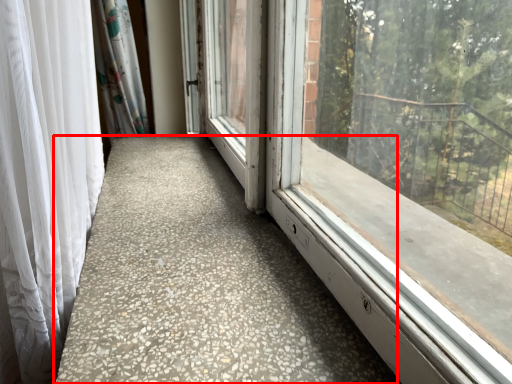
Question: From the image's perspective, where is concrete (annotated by the red box) located in relation to curtain in the image?

Choices:
 (A) below
 (B) above

Answer: (B)